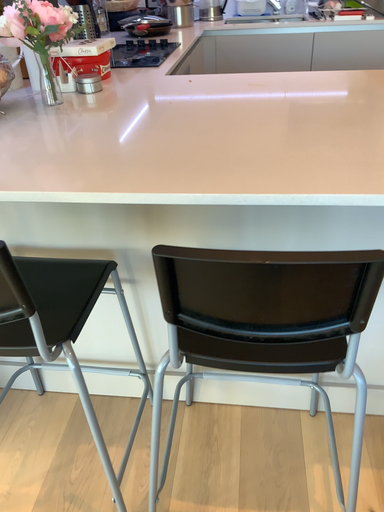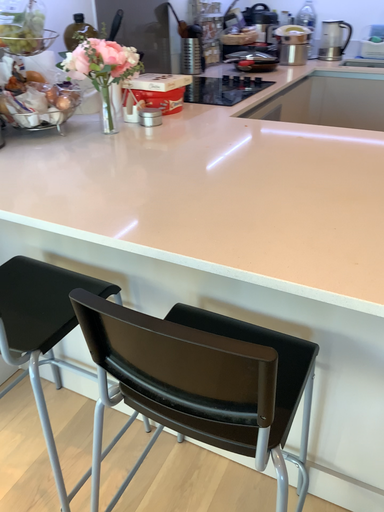
Question: How did the camera likely rotate when shooting the video?

Choices:
 (A) rotated left
 (B) rotated right

Answer: (A)